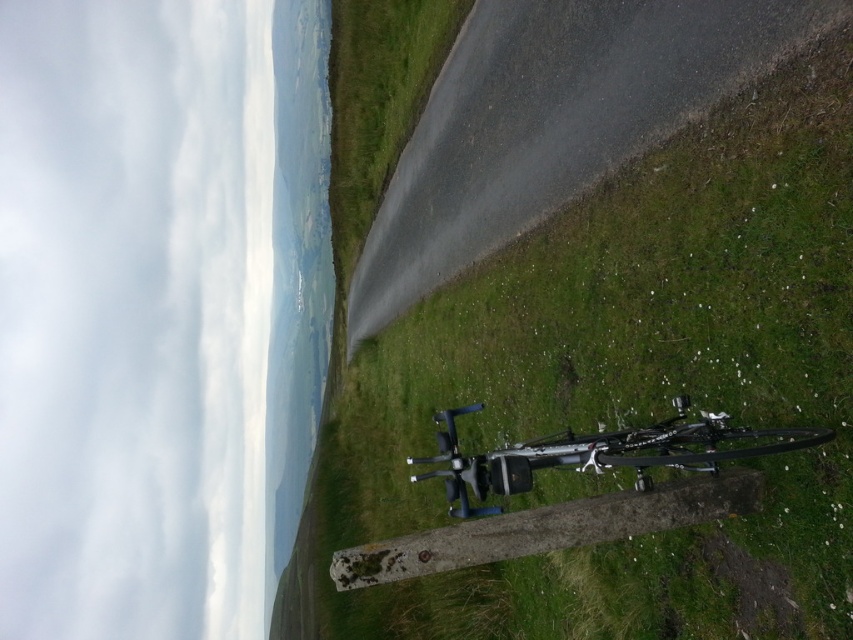
You are a drone operator who needs to land your metallic silver drone at center. The green grass at lower right is the closest suitable landing spot. Can your drone safely land there if it requires a minimum of 10 meters of clearance?

The distance between the green grass at lower right and the metallic silver drone at center is 12.25 meters, which exceeds the required 10 meters of clearance. Therefore, the drone can safely land there.

You are standing at the point closer to the camera in the image. Which point are you at, point (460, 230) or point (630, 438)?

You are at point (460, 230) because it is closer to the camera than point (630, 438).

You are standing at the center of the road in the rural scene. You want to place a small marker exactly at the green grass at lower right. According to the coordinates provided, where should you place it?

The green grass at lower right is located at point (608,321), so you should place the marker at those coordinates.